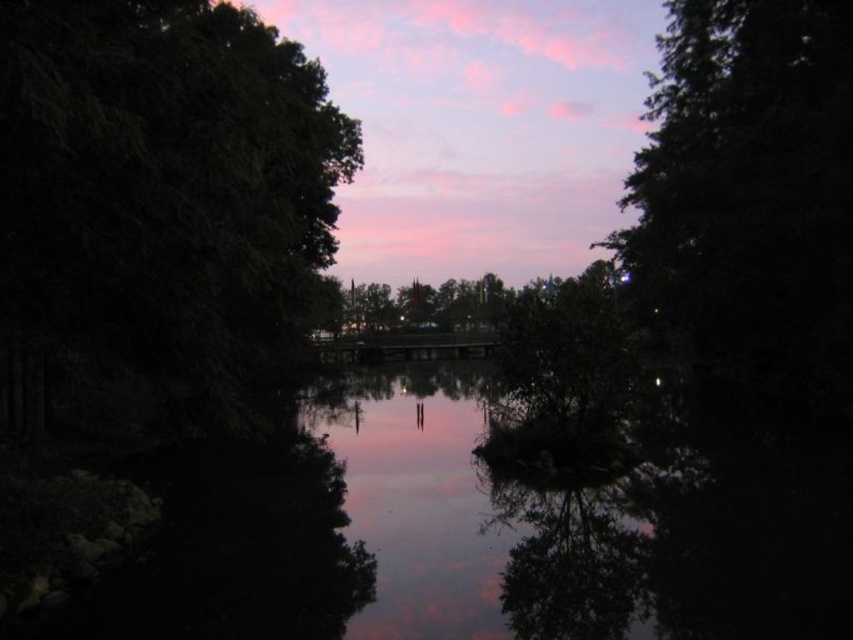
You are standing on the edge of the water and want to take a photo of the green leafy tree at left and the reflective glass water at center. Which object will appear closer to the camera in the photo?

The green leafy tree at left will appear closer to the camera in the photo because it is positioned in front of the reflective glass water at center.

You are standing at the center of the water in the image. Looking towards the upper right corner, you see a point marked at coordinates (751, 173). What object does this point correspond to?

The point at (751, 173) corresponds to the dark green leafy tree at upper right.

You are an observer standing at the edge of the water. You see the dark green leafy tree at upper right and the reflective glass water at center. Which object is positioned to the right of the other?

The dark green leafy tree at upper right is to the right of reflective glass water at center.